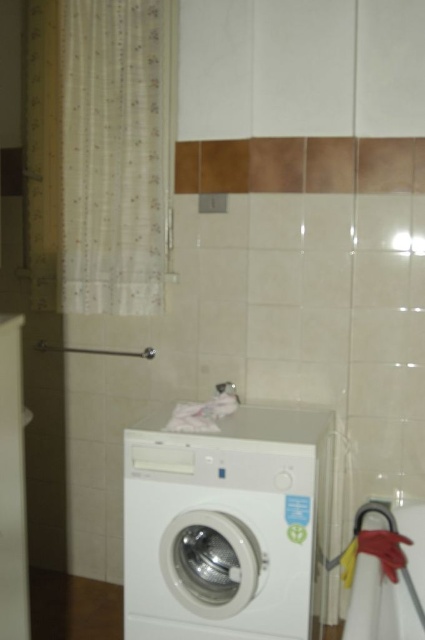
Question: Which object is closer to the camera taking this photo?

Choices:
 (A) white glossy washing machine at center
 (B) translucent fabric curtain at left

Answer: (A)

Question: Can you confirm if white glossy washing machine at center is positioned above translucent fabric curtain at left?

Choices:
 (A) no
 (B) yes

Answer: (A)

Question: Can you confirm if white glossy washing machine at center is smaller than translucent fabric curtain at left?

Choices:
 (A) yes
 (B) no

Answer: (B)

Question: Is the position of white glossy washing machine at center more distant than that of translucent fabric curtain at left?

Choices:
 (A) no
 (B) yes

Answer: (A)

Question: Which object is farther from the camera taking this photo?

Choices:
 (A) translucent fabric curtain at left
 (B) white glossy washing machine at center

Answer: (A)

Question: Which point is farther to the camera?

Choices:
 (A) (288, 412)
 (B) (130, 186)

Answer: (B)